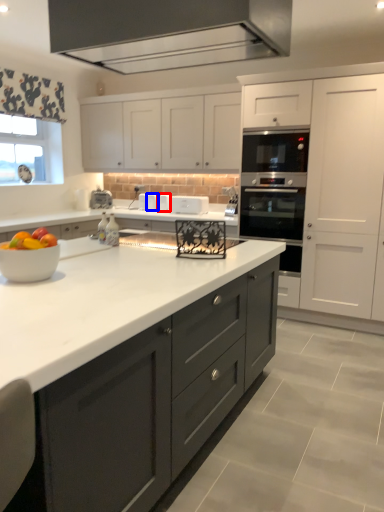
Question: Which object is closer to the camera taking this photo, appliance (highlighted by a red box) or appliance (highlighted by a blue box)?

Choices:
 (A) appliance
 (B) appliance

Answer: (A)